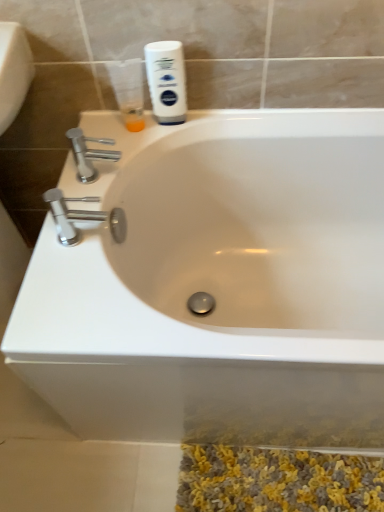
At what (x,y) coordinates should I click in order to perform the action: click on free location in front of chrome metallic faucet at left, the second tap when ordered from top to bottom. Please return your answer as a coordinate pair (x, y). Looking at the image, I should click on (82, 300).